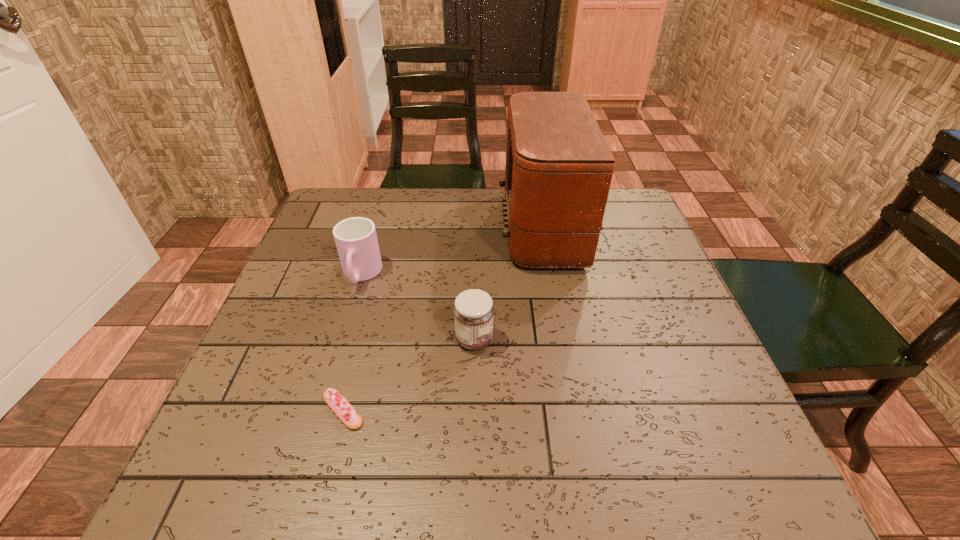
You are a GUI agent. You are given a task and a screenshot of the screen. Output one action in this format:
    pyautogui.click(x=<x>, y=<y>)
    Task: Click on the vacant area situated 0.230m with the handle on the side of the cup
    The image size is (960, 540).
    Given the screenshot: What is the action you would take?
    pyautogui.click(x=329, y=381)

Where is `vacant space situated 0.300m on the front label of the third farthest object`? This screenshot has width=960, height=540. vacant space situated 0.300m on the front label of the third farthest object is located at coordinates (641, 340).

At what (x,y) coordinates should I click in order to perform the action: click on free spot located on the front of the nearest object. Please return your answer as a coordinate pair (x, y). Looking at the image, I should click on (324, 485).

What are the coordinates of `object that is at the far edge` in the screenshot? It's located at (559, 167).

Find the location of a particular element. This screenshot has width=960, height=540. object that is at the left edge is located at coordinates (356, 240).

Where is `object that is at the right edge`? This screenshot has width=960, height=540. object that is at the right edge is located at coordinates (559, 167).

The image size is (960, 540). Identify the location of object present at the far right corner. (559, 167).

In the image, there is a desktop. Find the location of `vacant region at the far edge`. vacant region at the far edge is located at coordinates (489, 222).

In order to click on free space at the near edge of the desktop in this screenshot , I will do `click(446, 479)`.

In the image, there is a desktop. What are the coordinates of `vacant area at the left edge` in the screenshot? It's located at (229, 420).